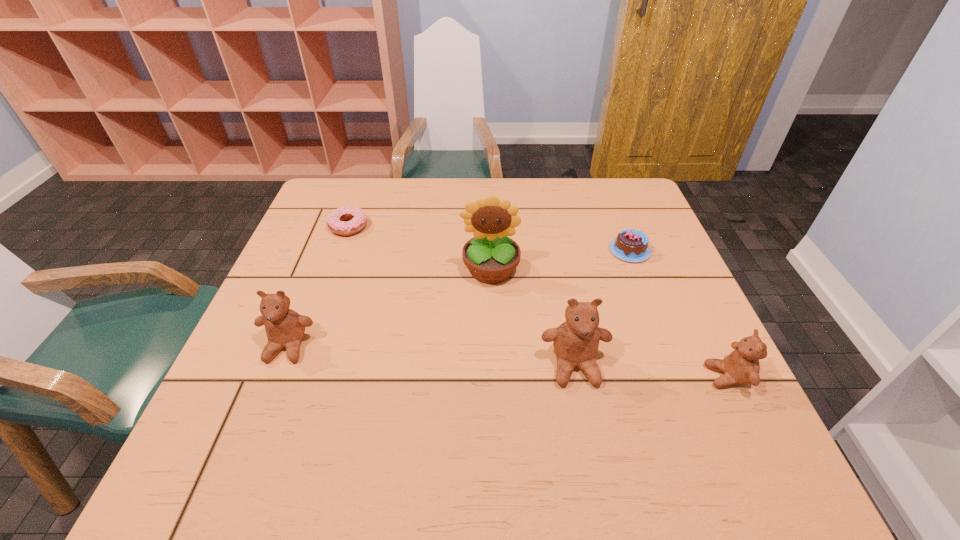
Locate an element on the screen. Image resolution: width=960 pixels, height=540 pixels. blank space located 0.140m on the face of the second tallest teddy bear is located at coordinates (255, 427).

Where is `vacant space located on the face of the second teddy bear from left to right`? The height and width of the screenshot is (540, 960). vacant space located on the face of the second teddy bear from left to right is located at coordinates (586, 422).

Where is `blank space located 0.130m on the face of the rightmost object`? blank space located 0.130m on the face of the rightmost object is located at coordinates (644, 376).

Identify the location of blank area located 0.250m on the face of the rightmost object. The image size is (960, 540). (586, 376).

Where is `free space located 0.340m on the face of the rightmost object`? The width and height of the screenshot is (960, 540). free space located 0.340m on the face of the rightmost object is located at coordinates (542, 376).

The width and height of the screenshot is (960, 540). What are the coordinates of `blank area located on the face of the fourth object from right to left` in the screenshot? It's located at (492, 326).

Locate an element on the screen. This screenshot has width=960, height=540. free spot located 0.330m on the front of the shortest object is located at coordinates (312, 328).

Identify the location of free region located 0.150m on the front of the chocolate cake. (651, 306).

Where is `object present at the far edge`? The width and height of the screenshot is (960, 540). object present at the far edge is located at coordinates (358, 220).

At what (x,y) coordinates should I click in order to perform the action: click on teddy bear present at the left edge. Please return your answer as a coordinate pair (x, y). The height and width of the screenshot is (540, 960). Looking at the image, I should click on click(285, 328).